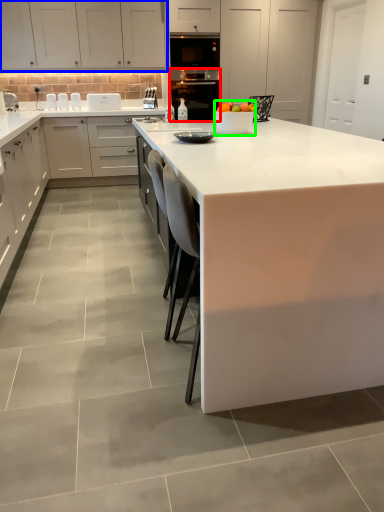
Question: Considering the real-world distances, which object is closest to home appliance (highlighted by a red box)? cabinetry (highlighted by a blue box) or appliance (highlighted by a green box).

Choices:
 (A) cabinetry
 (B) appliance

Answer: (A)